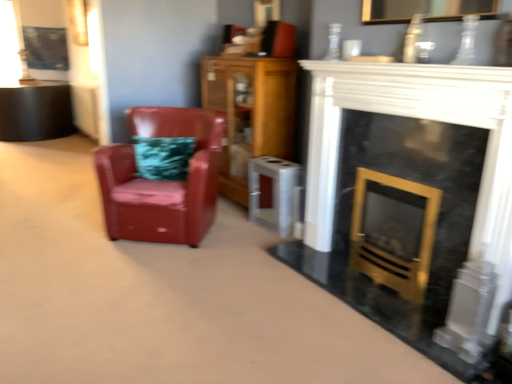
Question: Is metallic silver picture frame at upper left taller than wooden cabinet at center?

Choices:
 (A) no
 (B) yes

Answer: (A)

Question: Would you say wooden cabinet at center is part of metallic silver picture frame at upper left's contents?

Choices:
 (A) yes
 (B) no

Answer: (B)

Question: Does metallic silver picture frame at upper left appear on the left side of wooden cabinet at center?

Choices:
 (A) no
 (B) yes

Answer: (B)

Question: Is metallic silver picture frame at upper left positioned with its back to wooden cabinet at center?

Choices:
 (A) yes
 (B) no

Answer: (B)

Question: From the image's perspective, is metallic silver picture frame at upper left located above wooden cabinet at center?

Choices:
 (A) no
 (B) yes

Answer: (B)

Question: In terms of height, does wooden cabinet at center look taller or shorter compared to black marble fireplace at center?

Choices:
 (A) short
 (B) tall

Answer: (B)

Question: Is wooden cabinet at center wider or thinner than black marble fireplace at center?

Choices:
 (A) wide
 (B) thin

Answer: (A)

Question: From the image's perspective, is wooden cabinet at center located above or below black marble fireplace at center?

Choices:
 (A) above
 (B) below

Answer: (A)

Question: From a real-world perspective, is wooden cabinet at center above or below black marble fireplace at center?

Choices:
 (A) above
 (B) below

Answer: (A)

Question: Which is correct: black marble fireplace at center is inside glossy leather armchair at left, or outside of it?

Choices:
 (A) inside
 (B) outside

Answer: (B)

Question: From their relative heights in the image, would you say black marble fireplace at center is taller or shorter than glossy leather armchair at left?

Choices:
 (A) short
 (B) tall

Answer: (B)

Question: From the image's perspective, relative to glossy leather armchair at left, is black marble fireplace at center above or below?

Choices:
 (A) below
 (B) above

Answer: (A)

Question: Relative to glossy leather armchair at left, is black marble fireplace at center in front or behind?

Choices:
 (A) front
 (B) behind

Answer: (A)

Question: Is point (279, 76) closer or farther from the camera than point (54, 31)?

Choices:
 (A) farther
 (B) closer

Answer: (B)

Question: Is wooden cabinet at center situated inside metallic silver picture frame at upper left or outside?

Choices:
 (A) inside
 (B) outside

Answer: (B)